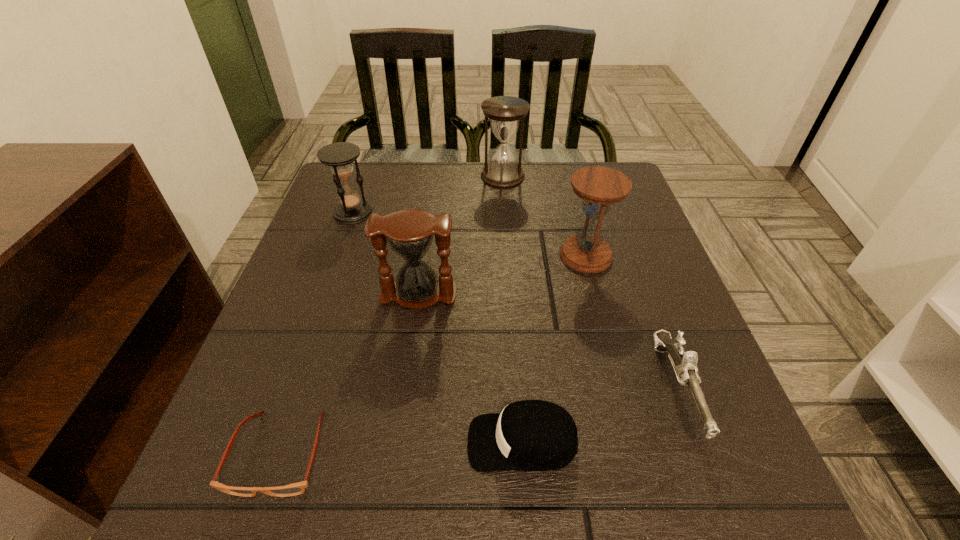
Identify the location of the farthest object. The image size is (960, 540). point(504,112).

This screenshot has width=960, height=540. I want to click on the farthest hourglass, so click(x=504, y=112).

Find the location of a particular element. The height and width of the screenshot is (540, 960). the rightmost hourglass is located at coordinates (599, 187).

In order to click on the second object from right to left in this screenshot , I will do `click(599, 187)`.

The width and height of the screenshot is (960, 540). Find the location of `the fifth object from right to left`. the fifth object from right to left is located at coordinates (409, 233).

Where is `the nearest hourglass`? This screenshot has width=960, height=540. the nearest hourglass is located at coordinates (409, 233).

Find the location of a particular element. the sixth nearest object is located at coordinates pyautogui.click(x=339, y=156).

At what (x,y) coordinates should I click in order to perform the action: click on the leftmost hourglass. Please return your answer as a coordinate pair (x, y). This screenshot has width=960, height=540. Looking at the image, I should click on (339, 156).

You are a GUI agent. You are given a task and a screenshot of the screen. Output one action in this format:
    pyautogui.click(x=<x>, y=<y>)
    Task: Click on the gun
    
    Given the screenshot: What is the action you would take?
    pyautogui.click(x=684, y=363)

You are a GUI agent. You are given a task and a screenshot of the screen. Output one action in this format:
    pyautogui.click(x=<x>, y=<y>)
    Task: Click on the fifth tallest object
    This screenshot has height=540, width=960.
    Given the screenshot: What is the action you would take?
    pyautogui.click(x=684, y=363)